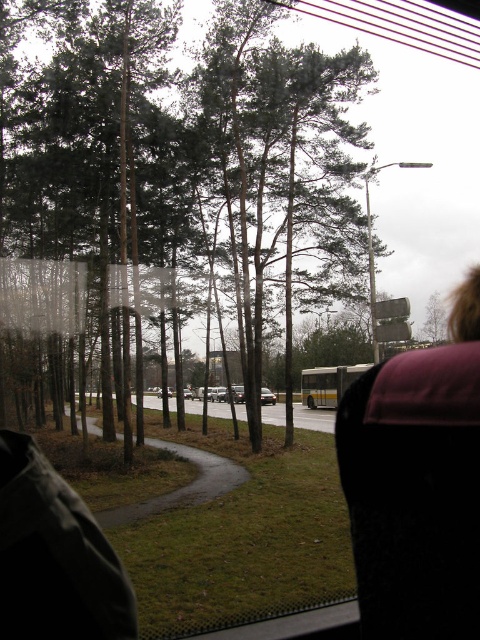
Can you confirm if yellow metallic bus at center is smaller than shiny silver sedan at center?

Incorrect, yellow metallic bus at center is not smaller in size than shiny silver sedan at center.

At what (x,y) coordinates should I click in order to perform the action: click on yellow metallic bus at center. Please return your answer as a coordinate pair (x, y). Looking at the image, I should click on click(327, 384).

Measure the distance from maroon fabric at upper right to shiny silver sedan at center.

maroon fabric at upper right and shiny silver sedan at center are 36.90 meters apart from each other.

Between maroon fabric at upper right and shiny silver sedan at center, which one has more height?

With more height is shiny silver sedan at center.

Where is `maroon fabric at upper right`? maroon fabric at upper right is located at coordinates (417, 483).

In the scene shown: Which is more to the left, maroon fabric at upper right or yellow metallic bus at center?

Positioned to the left is maroon fabric at upper right.

The image size is (480, 640). I want to click on maroon fabric at upper right, so point(417,483).

The height and width of the screenshot is (640, 480). I want to click on maroon fabric at upper right, so click(x=417, y=483).